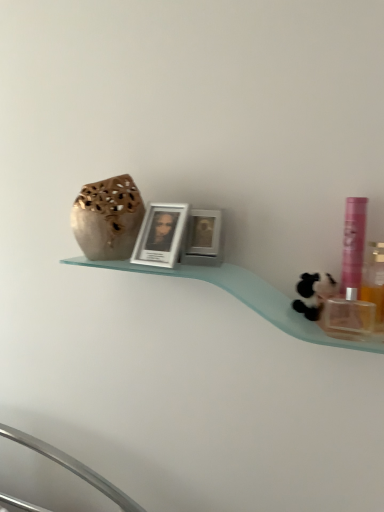
Question: Is point (77, 204) closer or farther from the camera than point (309, 289)?

Choices:
 (A) closer
 (B) farther

Answer: (B)

Question: Is matte beige vase at upper left in front of or behind black plush toy at right in the image?

Choices:
 (A) behind
 (B) front

Answer: (A)

Question: Which object is the farthest from the black plush toy at right?

Choices:
 (A) metallic silver picture frame at center, arranged as the first picture frame when viewed from the right
 (B) translucent plastic bottle at right, which appears as the second mouthwash when viewed from the left
 (C) white glossy picture frame at center, acting as the first picture frame starting from the left
 (D) pink plastic mouthwash at right, arranged as the first mouthwash when viewed from the left
 (E) matte beige vase at upper left

Answer: (E)

Question: Which object is positioned farthest from the matte beige vase at upper left?

Choices:
 (A) translucent plastic bottle at right, marked as the first mouthwash in a right-to-left arrangement
 (B) pink plastic mouthwash at right, arranged as the first mouthwash when viewed from the left
 (C) white glossy picture frame at center, acting as the first picture frame starting from the left
 (D) black plush toy at right
 (E) metallic silver picture frame at center, arranged as the first picture frame when viewed from the right

Answer: (A)